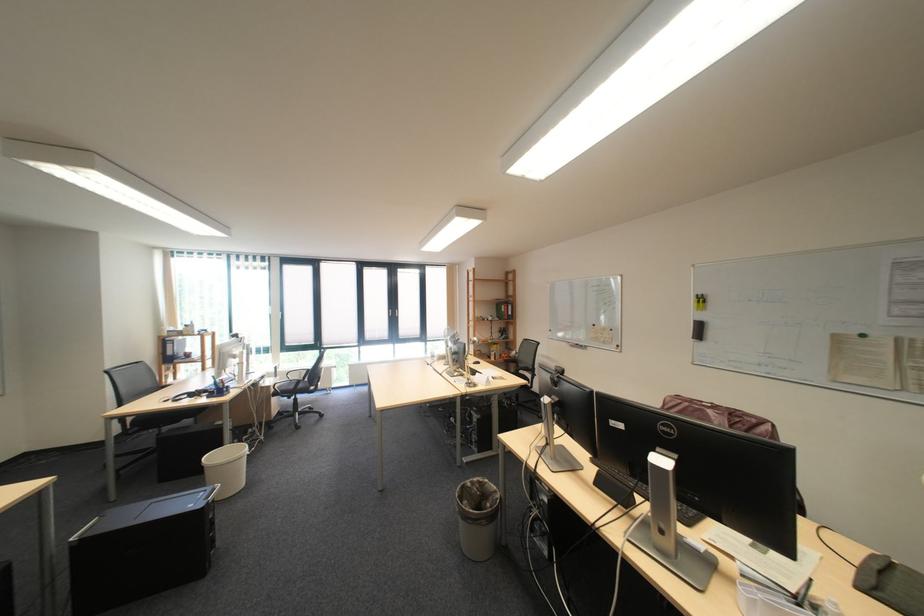
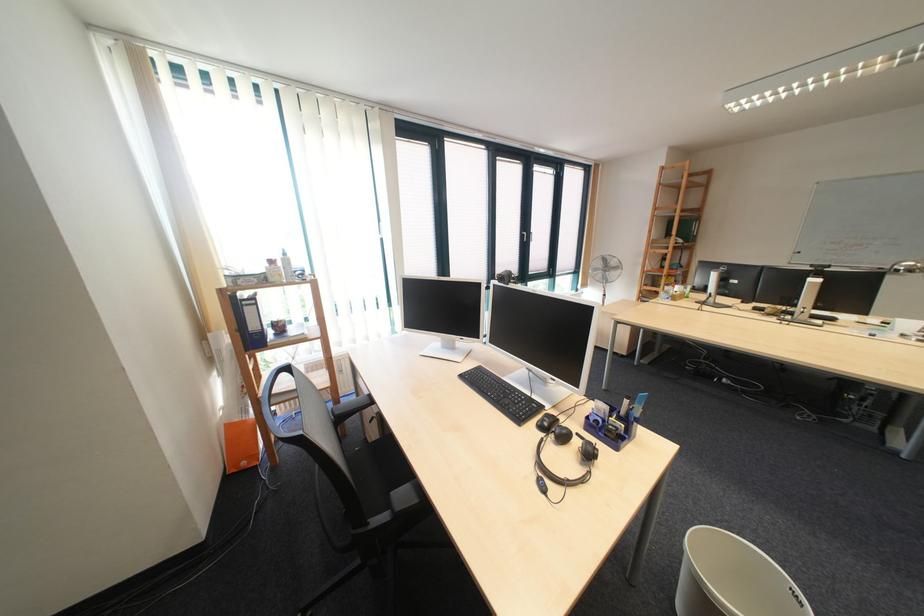
In the second image, find the point that corresponds to point 405,315 in the first image.

(540, 241)